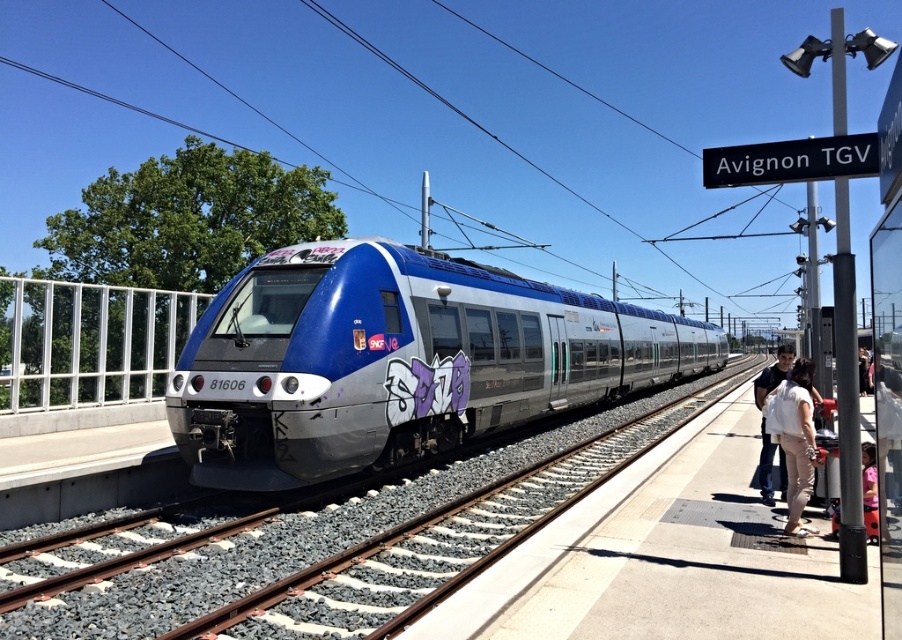
You are a photographer standing on the platform at Avignon TGV station. You notice two items in the scene described in the image. One is the light beige pants at right and the other is the pink fabric at lower right. From your position, which item is positioned to the left?

The light beige pants at right is to the left of the pink fabric at lower right, so the light beige pants at right is positioned to the left.

You are standing at the platform of Avignon TGV station and want to reach the point marked at coordinates (x=803, y=467). If your walking speed is 1.2 meters per second, how many seconds will it take you to reach that point?

The point marked at coordinates (x=803, y=467) is 6.43 meters away from you. At a walking speed of 1.2 meters per second, it will take approximately 5.36 seconds to reach the point.